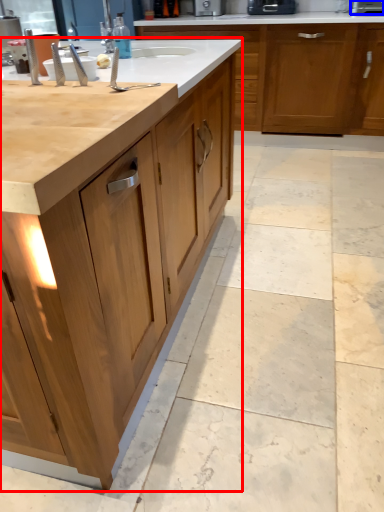
Question: Among these objects, which one is nearest to the camera, cabinetry (highlighted by a red box) or appliance (highlighted by a blue box)?

Choices:
 (A) cabinetry
 (B) appliance

Answer: (A)